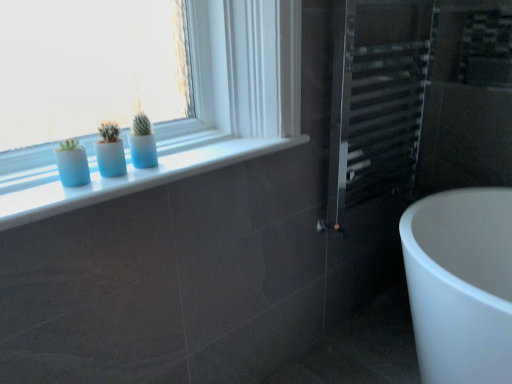
Identify the location of free space above white glossy window sill at upper center (from a real-world perspective). (196, 158).